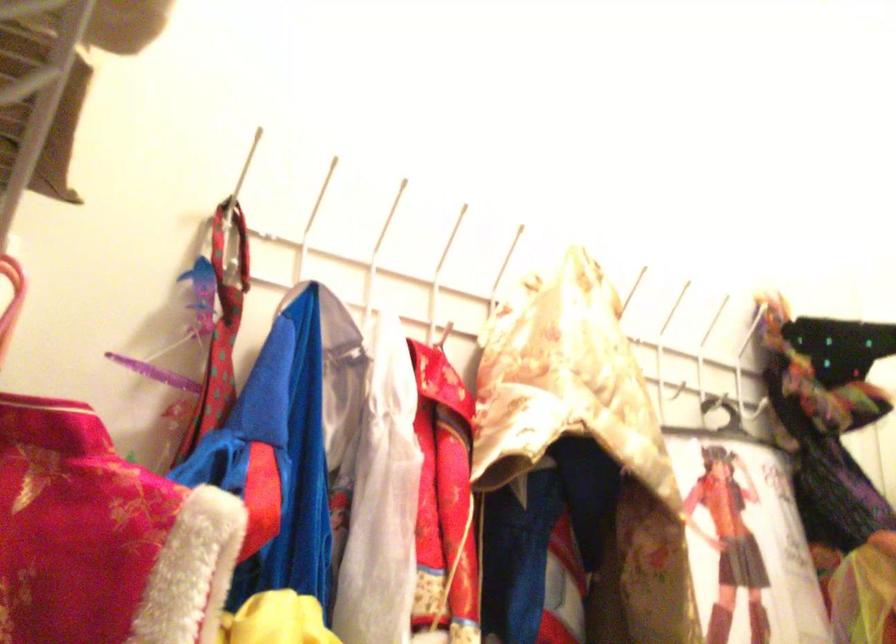
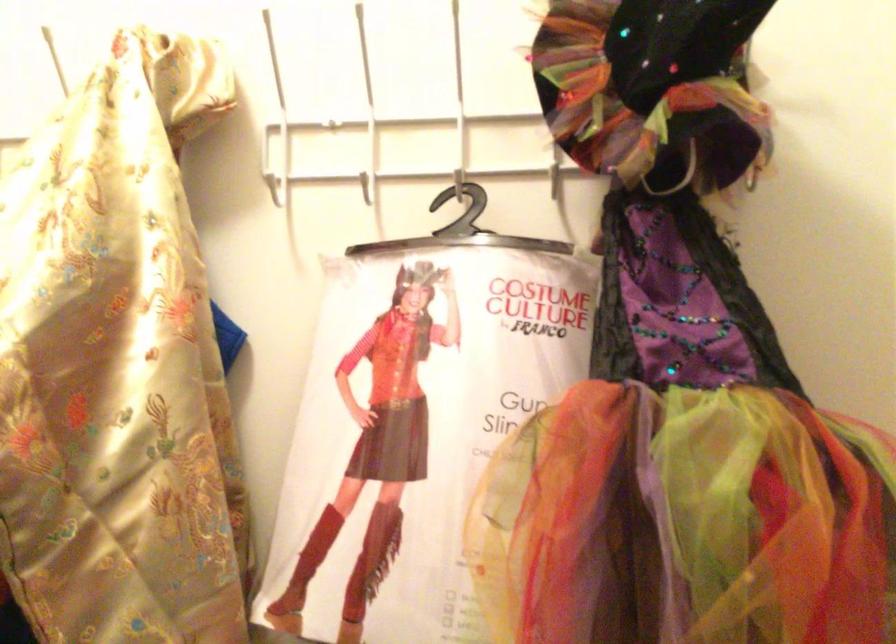
In the second image, find the point that corresponds to point (650, 377) in the first image.

(366, 187)